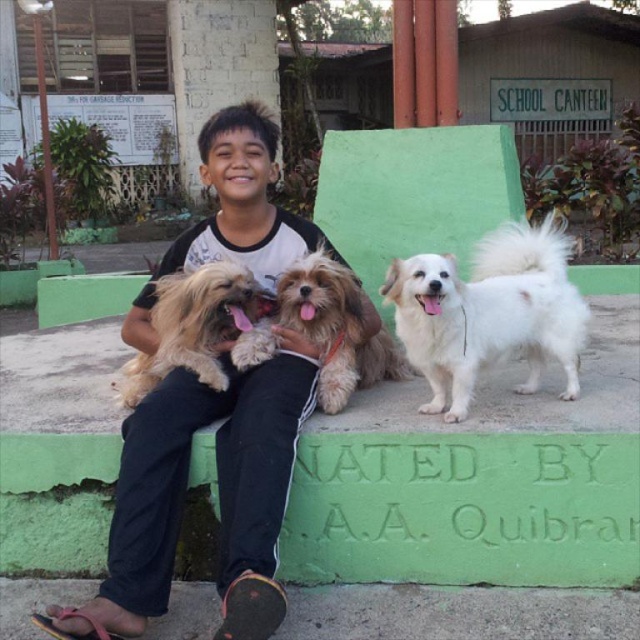
You are a photographer trying to capture a group photo of the two dogs. You have a rectangular photo frame that can only accommodate the width of the fuzzy brown dog at center. Will the white fluffy dog at right fit into the frame?

The white fluffy dog at right is wider than the fuzzy brown dog at center, so it will not fit into the frame designed for the fuzzy brown dog at center.

The young boy is wearing a black cotton shirt at center and has a fuzzy brown dog at center in his lap. Which item is located lower on his body?

The black cotton shirt at center is positioned under the fuzzy brown dog at center, so the black cotton shirt at center is located lower on his body.